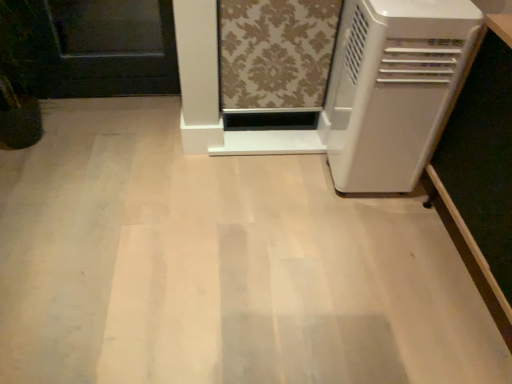
What do you see at coordinates (393, 88) in the screenshot? This screenshot has width=512, height=384. I see `white plastic air conditioner at right` at bounding box center [393, 88].

Where is `white plastic air conditioner at right`? This screenshot has height=384, width=512. white plastic air conditioner at right is located at coordinates (393, 88).

The image size is (512, 384). I want to click on white plastic air conditioner at right, so click(393, 88).